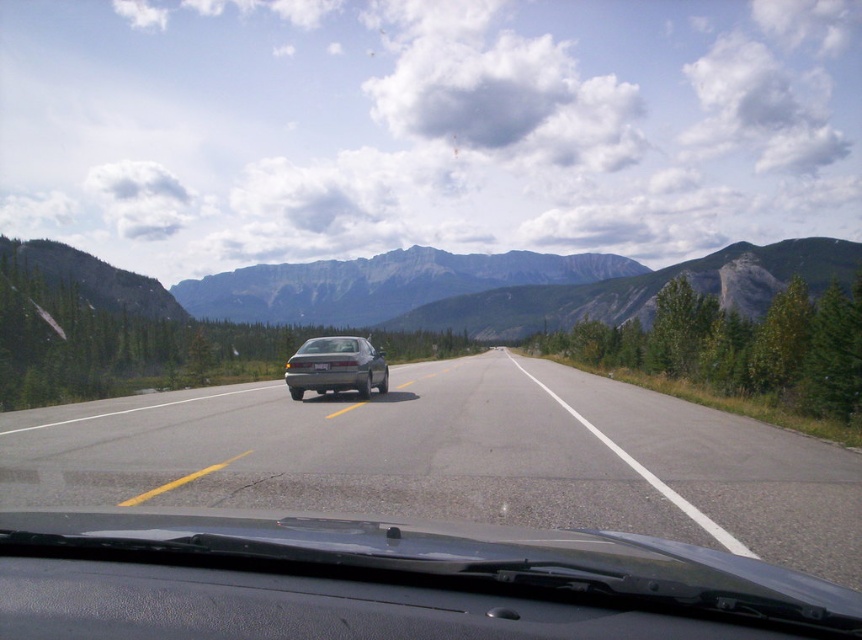
Is point (578, 259) closer to camera compared to point (334, 342)?

No, (578, 259) is behind (334, 342).

What do you see at coordinates (380, 284) in the screenshot? This screenshot has width=862, height=640. I see `gray rock mountain at center` at bounding box center [380, 284].

Which is in front, point (490, 272) or point (329, 353)?

Positioned in front is point (329, 353).

The height and width of the screenshot is (640, 862). I want to click on gray rock mountain at center, so click(x=380, y=284).

Consider the image. Is satin silver sedan at center to the right of matte gray car at center from the viewer's perspective?

Yes, satin silver sedan at center is to the right of matte gray car at center.

Measure the distance between point (x=315, y=364) and camera.

Point (x=315, y=364) and camera are 61.10 feet apart.

At what (x,y) coordinates should I click in order to perform the action: click on satin silver sedan at center. Please return your answer as a coordinate pair (x, y). Looking at the image, I should click on (336, 365).

Does black plastic dashboard at center have a lesser width compared to gray rock mountain at center?

Correct, black plastic dashboard at center's width is less than gray rock mountain at center's.

Find the location of a particular element. black plastic dashboard at center is located at coordinates (386, 582).